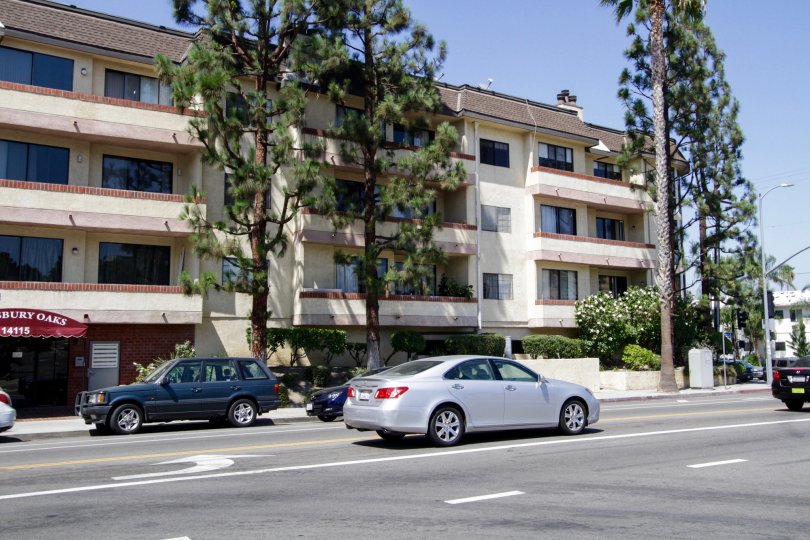
Find the location of a particular element. trash can is located at coordinates (705, 363).